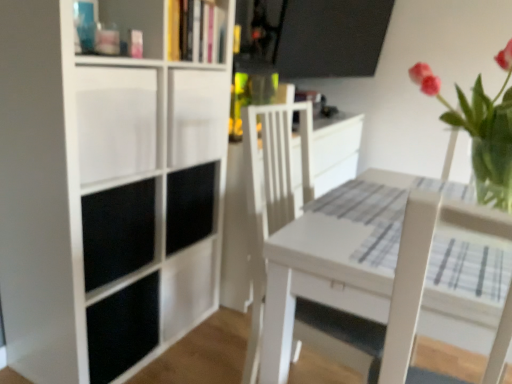
Question: Is point (180, 11) closer or farther from the camera than point (138, 155)?

Choices:
 (A) closer
 (B) farther

Answer: (B)

Question: From a real-world perspective, is hardcover book at upper center above or below white matte cabinet at left, which ranks as the 1th cabinet in front-to-back order?

Choices:
 (A) above
 (B) below

Answer: (A)

Question: Considering the real-world distances, which object is farthest from the white matte cabinet at left, the second cabinet when ordered from back to front?

Choices:
 (A) white matte bookcase at left
 (B) hardcover book at upper center
 (C) pink glass vase at upper right
 (D) black matte cabinet at center, the 1th cabinet from the back
 (E) white wood swivel chair at center

Answer: (C)

Question: Which of these objects is positioned farthest from the white matte cabinet at left, the second cabinet when ordered from back to front?

Choices:
 (A) white wood swivel chair at center
 (B) pink glass vase at upper right
 (C) hardcover book at upper center
 (D) black matte cabinet at center, the 1th cabinet from the back
 (E) white wood table at center

Answer: (B)